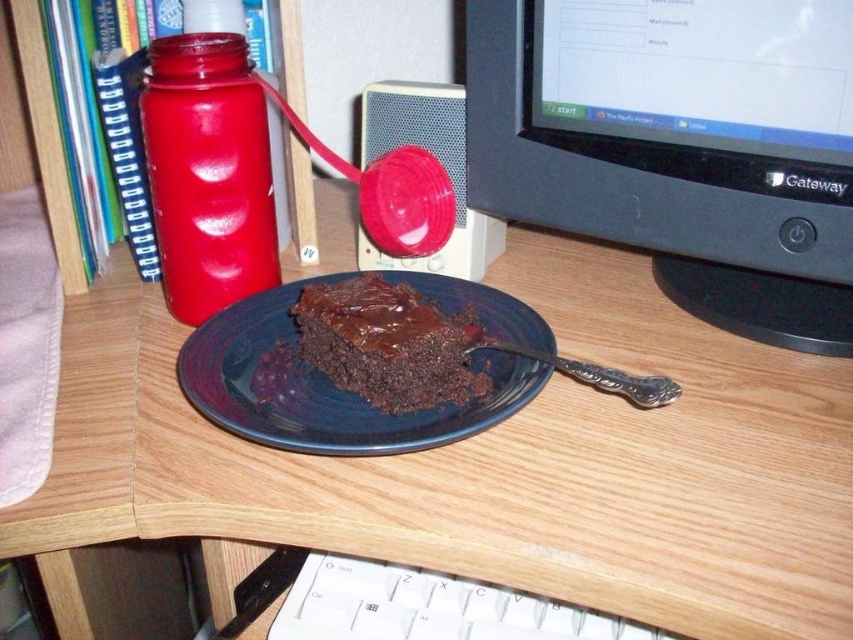
You are organizing items on a desk and need to place a new item between the white plastic keyboard at lower center and the chocolate glossy cake at center. Based on their positions, which side of the cake should you place the new item to ensure it is between them?

Since the white plastic keyboard at lower center is to the right of the chocolate glossy cake at center, you should place the new item to the right side of the cake, between the cake and the keyboard.

You are a person sitting at the desk and want to reach for the white plastic keyboard at lower center. Where should you look to find it?

The white plastic keyboard at lower center is located at point (428,608).